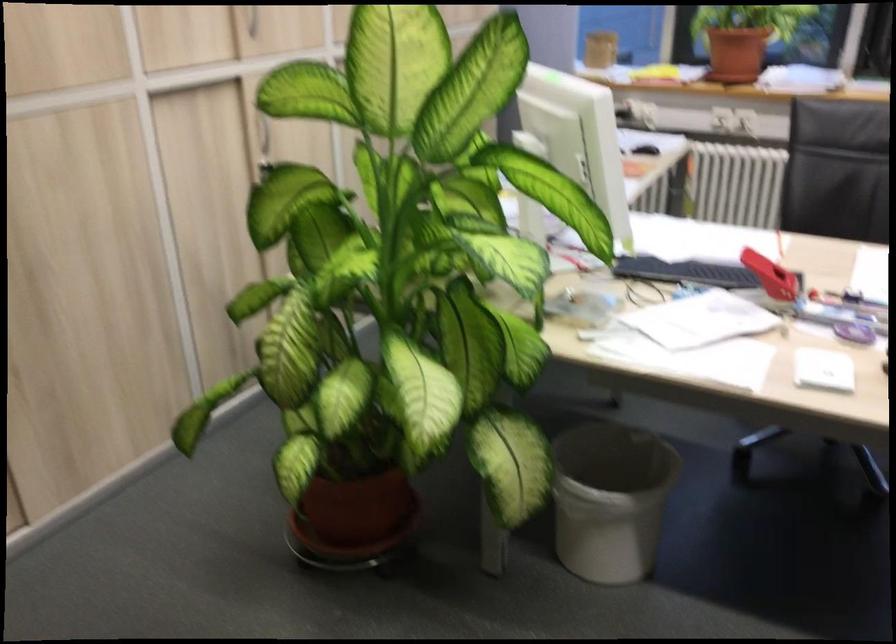
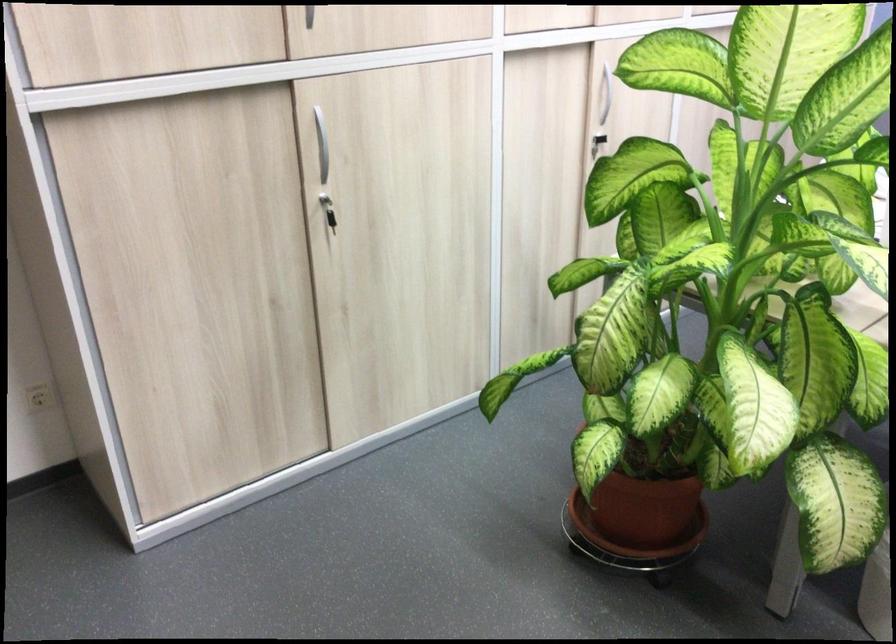
Find the pixel in the second image that matches [363,514] in the first image.

(643, 509)